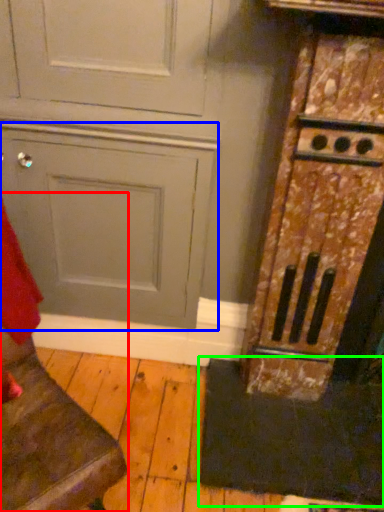
Question: Which is nearer to the furniture (highlighted by a red box)? door (highlighted by a blue box) or doormat (highlighted by a green box).

Choices:
 (A) door
 (B) doormat

Answer: (A)